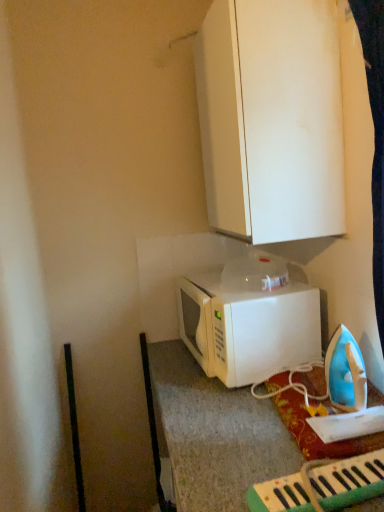
Question: Considering their positions, is green plastic keyboard at lower right located in front of or behind white matte cabinet at upper center?

Choices:
 (A) behind
 (B) front

Answer: (B)

Question: Which is correct: green plastic keyboard at lower right is inside white matte cabinet at upper center, or outside of it?

Choices:
 (A) outside
 (B) inside

Answer: (A)

Question: Estimate the real-world distances between objects in this image. Which object is closer to the green plastic keyboard at lower right?

Choices:
 (A) white matte microwave at center
 (B) white matte cabinet at upper center

Answer: (A)

Question: Considering the real-world distances, which object is farthest from the white matte microwave at center?

Choices:
 (A) green plastic keyboard at lower right
 (B) white matte cabinet at upper center

Answer: (A)